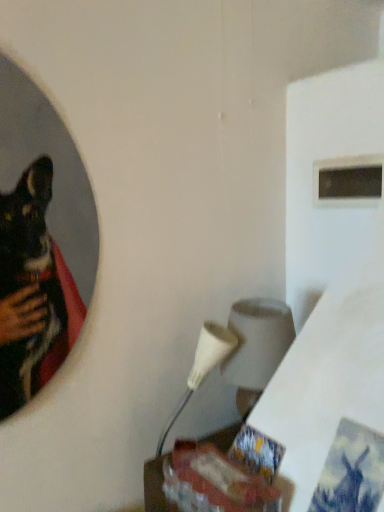
In order to face black matte window at upper right, should I rotate leftwards or rightwards?

Rotate your view right by about 21.029°.

At what (x,y) coordinates should I click in order to perform the action: click on black matte window at upper right. Please return your answer as a coordinate pair (x, y). The width and height of the screenshot is (384, 512). Looking at the image, I should click on (348, 181).

The height and width of the screenshot is (512, 384). What do you see at coordinates (40, 238) in the screenshot?
I see `black glossy mirror at upper left` at bounding box center [40, 238].

You are a GUI agent. You are given a task and a screenshot of the screen. Output one action in this format:
    pyautogui.click(x=<x>, y=<y>)
    Task: Click on the white matte lampshade at center-right
    The height and width of the screenshot is (512, 384).
    Given the screenshot: What is the action you would take?
    click(256, 347)

Which of these two, white matte lampshade at center-right or black glossy mirror at upper left, is wider?

With larger width is white matte lampshade at center-right.

Considering the points (251, 335) and (78, 278), which point is behind, point (251, 335) or point (78, 278)?

The point (78, 278) is farther from the camera.

Looking at this image, is white matte lampshade at center-right with black glossy mirror at upper left?

There is a gap between white matte lampshade at center-right and black glossy mirror at upper left.

Do you think white matte lampshade at center-right is within black glossy mirror at upper left, or outside of it?

white matte lampshade at center-right is outside black glossy mirror at upper left.

Considering the relative sizes of wooden table at lower center and black glossy mirror at upper left in the image provided, is wooden table at lower center shorter than black glossy mirror at upper left?

Yes.

From the image's perspective, is wooden table at lower center on top of black glossy mirror at upper left?

Incorrect, from the image's perspective, wooden table at lower center is lower than black glossy mirror at upper left.

Looking at this image, could you tell me if wooden table at lower center is turned towards black glossy mirror at upper left?

No.

Is black matte window at upper right turned away from white matte lampshade at center-right?

black matte window at upper right does not have its back to white matte lampshade at center-right.

From the picture: Are black matte window at upper right and white matte lampshade at center-right making contact?

No, black matte window at upper right is not next to white matte lampshade at center-right.

Which of these two, black matte window at upper right or white matte lampshade at center-right, stands taller?

white matte lampshade at center-right is taller.

Does point (351, 190) appear closer or farther from the camera than point (252, 328)?

Point (351, 190).

Considering the relative sizes of black glossy mirror at upper left and wooden table at lower center in the image provided, is black glossy mirror at upper left taller than wooden table at lower center?

Yes, black glossy mirror at upper left is taller than wooden table at lower center.

From the picture: Is wooden table at lower center a part of black glossy mirror at upper left?

Actually, wooden table at lower center is outside black glossy mirror at upper left.

Considering the relative sizes of wooden table at lower center and white matte lampshade at center-right in the image provided, is wooden table at lower center wider than white matte lampshade at center-right?

Incorrect, the width of wooden table at lower center does not surpass that of white matte lampshade at center-right.

Is point (162, 472) farther from viewer compared to point (258, 319)?

No, (162, 472) is closer to viewer.

Could you tell me if wooden table at lower center is facing white matte lampshade at center-right?

No, wooden table at lower center is not turned towards white matte lampshade at center-right.

In the scene shown: From a real-world perspective, does wooden table at lower center stand above white matte lampshade at center-right?

No.

In the scene shown: Is white matte lampshade at center-right shorter than black matte window at upper right?

In fact, white matte lampshade at center-right may be taller than black matte window at upper right.

Is white matte lampshade at center-right positioned far away from black matte window at upper right?

That's not correct — white matte lampshade at center-right is a little close to black matte window at upper right.

This screenshot has height=512, width=384. Find the location of `window behind the white matte lampshade at center-right`. window behind the white matte lampshade at center-right is located at coordinates (348, 181).

Considering the sizes of black matte window at upper right and black glossy mirror at upper left in the image, is black matte window at upper right bigger or smaller than black glossy mirror at upper left?

Clearly, black matte window at upper right is smaller in size than black glossy mirror at upper left.

Is black matte window at upper right facing towards black glossy mirror at upper left?

Yes, black matte window at upper right is facing black glossy mirror at upper left.

Is black matte window at upper right surrounding black glossy mirror at upper left?

No, black matte window at upper right does not contain black glossy mirror at upper left.

Looking at their sizes, would you say black matte window at upper right is wider or thinner than black glossy mirror at upper left?

black matte window at upper right is wider than black glossy mirror at upper left.

Identify the location of mirror above the white matte lampshade at center-right (from the image's perspective). The height and width of the screenshot is (512, 384). (40, 238).

Where is `mirror behind the wooden table at lower center`? mirror behind the wooden table at lower center is located at coordinates (40, 238).

From the image, which object appears to be farther from black glossy mirror at upper left, wooden table at lower center or white matte lampshade at center-right?

Based on the image, wooden table at lower center appears to be further to black glossy mirror at upper left.

Looking at the image, which one is located closer to white matte lampshade at center-right, black glossy mirror at upper left or black matte window at upper right?

black glossy mirror at upper left.

From the image, which object appears to be nearer to black matte window at upper right, black glossy mirror at upper left or white matte lampshade at center-right?

Based on the image, white matte lampshade at center-right appears to be nearer to black matte window at upper right.

Considering their positions, is black glossy mirror at upper left positioned closer to wooden table at lower center than white matte lampshade at center-right?

white matte lampshade at center-right is positioned closer to the anchor wooden table at lower center.

Looking at the image, which one is located closer to black matte window at upper right, wooden table at lower center or black glossy mirror at upper left?

wooden table at lower center is closer to black matte window at upper right.

Estimate the real-world distances between objects in this image. Which object is further from black glossy mirror at upper left, black matte window at upper right or white matte lampshade at center-right?

black matte window at upper right lies further to black glossy mirror at upper left than the other object.

From the image, which object appears to be nearer to wooden table at lower center, black matte window at upper right or white matte lampshade at center-right?

white matte lampshade at center-right.

Based on their spatial positions, is black glossy mirror at upper left or wooden table at lower center further from white matte lampshade at center-right?

black glossy mirror at upper left.

Where is `lamp between black matte window at upper right and wooden table at lower center in the vertical direction`? The image size is (384, 512). lamp between black matte window at upper right and wooden table at lower center in the vertical direction is located at coordinates (256, 347).

Find the location of a particular element. table between black glossy mirror at upper left and black matte window at upper right in the horizontal direction is located at coordinates (155, 486).

At what (x,y) coordinates should I click in order to perform the action: click on table between black glossy mirror at upper left and white matte lampshade at center-right. Please return your answer as a coordinate pair (x, y). Looking at the image, I should click on (155, 486).

You are a GUI agent. You are given a task and a screenshot of the screen. Output one action in this format:
    pyautogui.click(x=<x>, y=<y>)
    Task: Click on the lamp situated between black glossy mirror at upper left and black matte window at upper right from left to right
    The height and width of the screenshot is (512, 384).
    Given the screenshot: What is the action you would take?
    pyautogui.click(x=256, y=347)